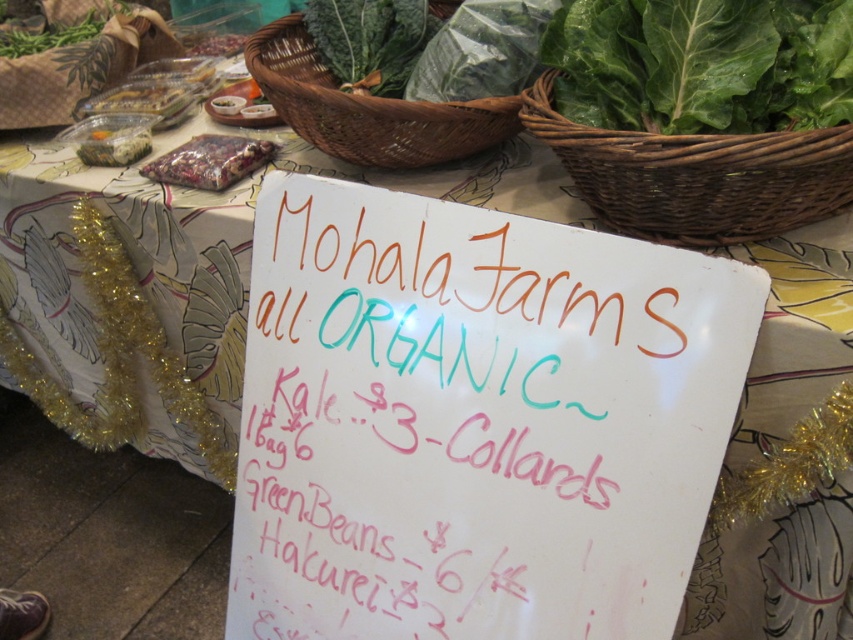
Between woven brown basket at upper right and translucent plastic container at upper left, which one appears on the right side from the viewer's perspective?

woven brown basket at upper right is more to the right.

What do you see at coordinates (695, 177) in the screenshot?
I see `woven brown basket at upper right` at bounding box center [695, 177].

At what (x,y) coordinates should I click in order to perform the action: click on woven brown basket at upper right. Please return your answer as a coordinate pair (x, y). The height and width of the screenshot is (640, 853). Looking at the image, I should click on (695, 177).

Can you confirm if brown woven basket at upper center is thinner than translucent plastic container at upper left?

In fact, brown woven basket at upper center might be wider than translucent plastic container at upper left.

Is brown woven basket at upper center taller than translucent plastic container at upper left?

Yes.

Is point (509, 113) farther from camera compared to point (76, 148)?

No, (509, 113) is in front of (76, 148).

Where is `brown woven basket at upper center`? brown woven basket at upper center is located at coordinates (367, 108).

Which is behind, point (328, 120) or point (462, 52)?

Point (462, 52)

How far apart are brown woven basket at upper center and green leafy at center?

A distance of 4.65 inches exists between brown woven basket at upper center and green leafy at center.

The height and width of the screenshot is (640, 853). Find the location of `brown woven basket at upper center`. brown woven basket at upper center is located at coordinates (367, 108).